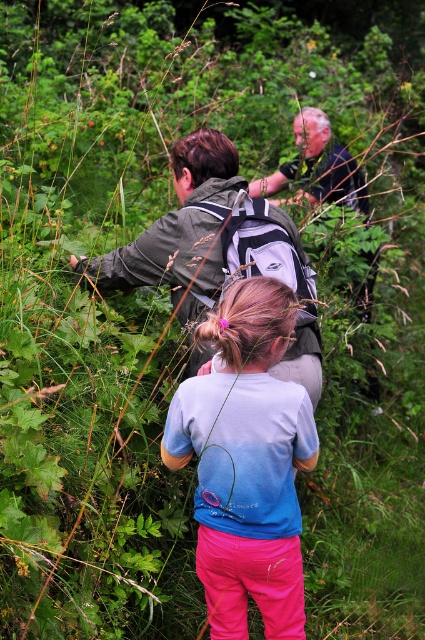
Question: Does light blue cotton shirt at center appear on the left side of dark blue shirt at center?

Choices:
 (A) yes
 (B) no

Answer: (A)

Question: Which point is closer to the camera?

Choices:
 (A) (320, 179)
 (B) (255, 314)

Answer: (B)

Question: Can you confirm if green fabric jacket at center is wider than dark blue shirt at center?

Choices:
 (A) yes
 (B) no

Answer: (A)

Question: Among these points, which one is farthest from the camera?

Choices:
 (A) (71, 262)
 (B) (220, 508)

Answer: (A)

Question: Among these objects, which one is nearest to the camera?

Choices:
 (A) light blue cotton shirt at center
 (B) green fabric jacket at center
 (C) dark blue shirt at center

Answer: (A)

Question: Is the position of light blue cotton shirt at center more distant than that of dark blue shirt at center?

Choices:
 (A) no
 (B) yes

Answer: (A)